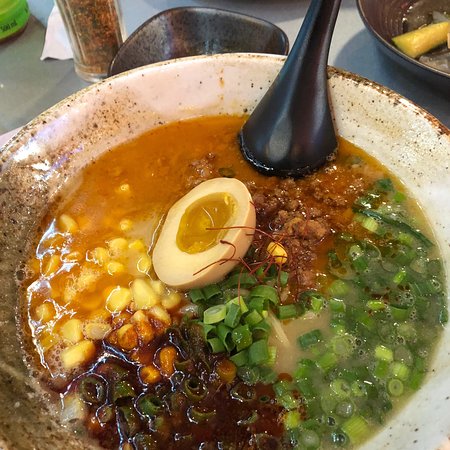
Locate an element on the screen. This screenshot has width=450, height=450. small black bowl for individual serving is located at coordinates (185, 28).